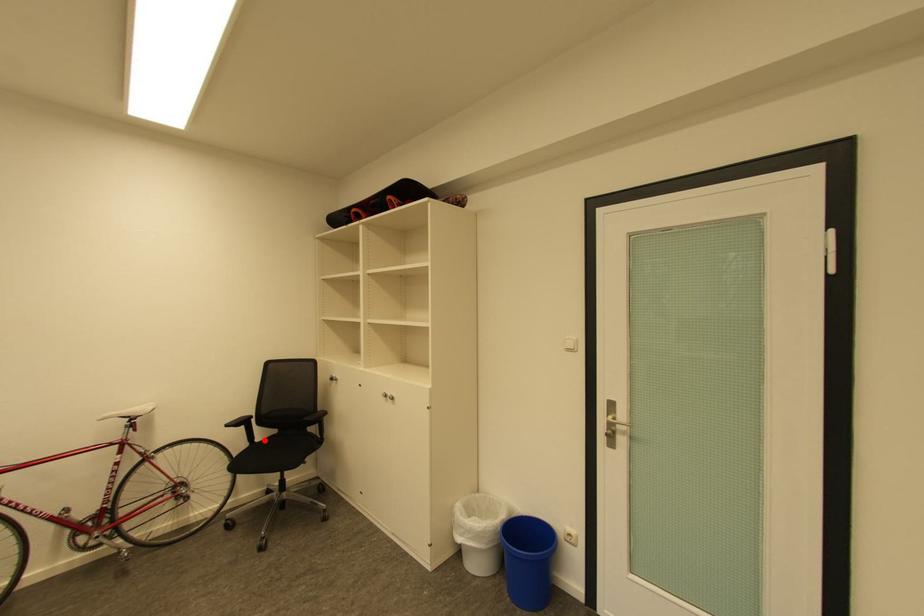
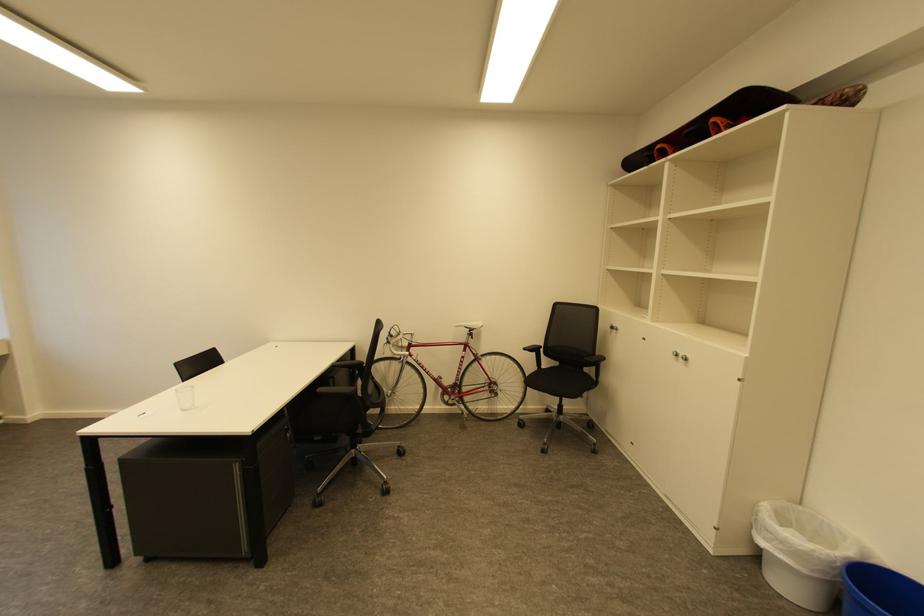
Where in the second image is the point corresponding to the highlighted location from the first image?

(551, 368)